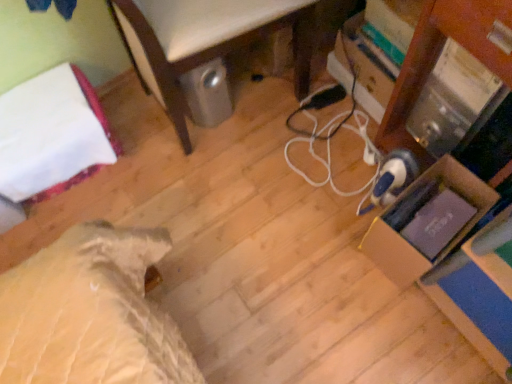
You are a GUI agent. You are given a task and a screenshot of the screen. Output one action in this format:
    pyautogui.click(x=<x>, y=<y>)
    Task: Click on the vacant space behind white cord at center
    
    Given the screenshot: What is the action you would take?
    click(x=285, y=101)